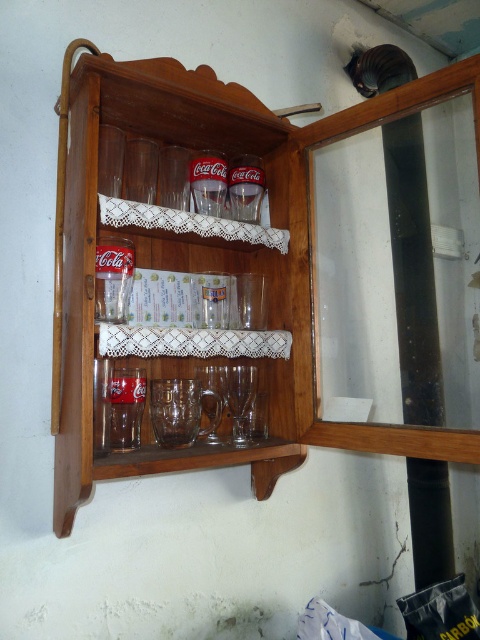
Question: Is wooden cabinet at center smaller than clear glass wine glass at center?

Choices:
 (A) yes
 (B) no

Answer: (B)

Question: Does wooden cabinet at center appear on the right side of clear glass wine glass at center?

Choices:
 (A) yes
 (B) no

Answer: (B)

Question: Among these objects, which one is farthest from the camera?

Choices:
 (A) wooden cabinet at center
 (B) clear glass wine glass at center

Answer: (B)

Question: Among these points, which one is nearest to the camera?

Choices:
 (A) (287, 392)
 (B) (236, 376)

Answer: (B)

Question: Does wooden cabinet at center appear under clear glass wine glass at center?

Choices:
 (A) yes
 (B) no

Answer: (B)

Question: Among these points, which one is nearest to the camera?

Choices:
 (A) (238, 413)
 (B) (124, 113)

Answer: (B)